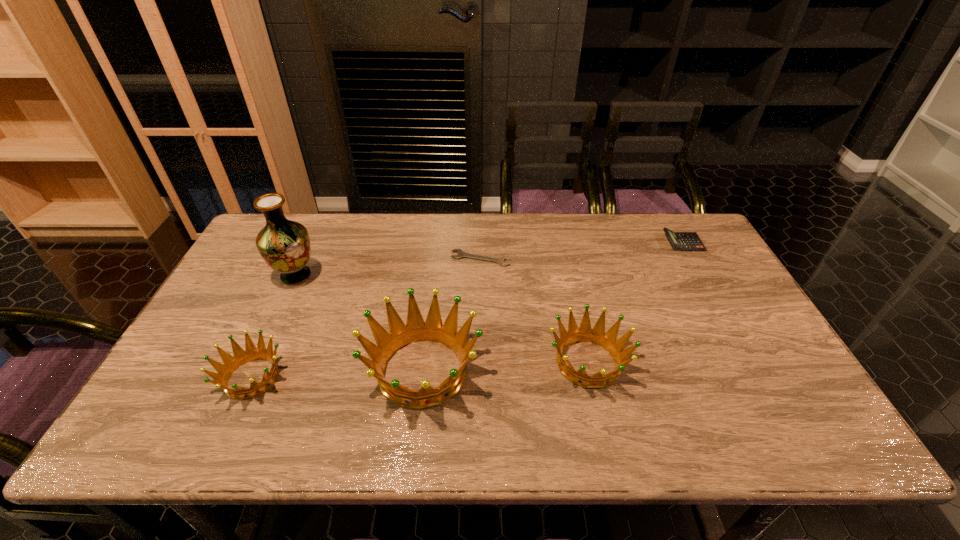
Identify the location of the leftmost crown. Image resolution: width=960 pixels, height=540 pixels. (251, 353).

You are a GUI agent. You are given a task and a screenshot of the screen. Output one action in this format:
    pyautogui.click(x=<x>, y=<y>)
    Task: Click on the fourth tallest object
    
    Given the screenshot: What is the action you would take?
    pyautogui.click(x=251, y=353)

You are a GUI agent. You are given a task and a screenshot of the screen. Output one action in this format:
    pyautogui.click(x=<x>, y=<y>)
    Task: Click on the second tallest object
    The width and height of the screenshot is (960, 540).
    Given the screenshot: What is the action you would take?
    pyautogui.click(x=416, y=330)

Where is `the second crown from right to left`? The image size is (960, 540). the second crown from right to left is located at coordinates pos(416,330).

Where is `the fifth object from left to right`? Image resolution: width=960 pixels, height=540 pixels. the fifth object from left to right is located at coordinates (596, 335).

The width and height of the screenshot is (960, 540). In order to click on the third tallest object in this screenshot , I will do `click(596, 335)`.

This screenshot has width=960, height=540. What are the coordinates of `wrench` in the screenshot? It's located at (461, 254).

This screenshot has width=960, height=540. Identify the location of the rightmost object. (685, 241).

Locate an element on the screen. The height and width of the screenshot is (540, 960). the fifth tallest object is located at coordinates (685, 241).

You are a GUI agent. You are given a task and a screenshot of the screen. Output one action in this format:
    pyautogui.click(x=<x>, y=<y>)
    Task: Click on the vase
    
    Given the screenshot: What is the action you would take?
    pyautogui.click(x=284, y=245)